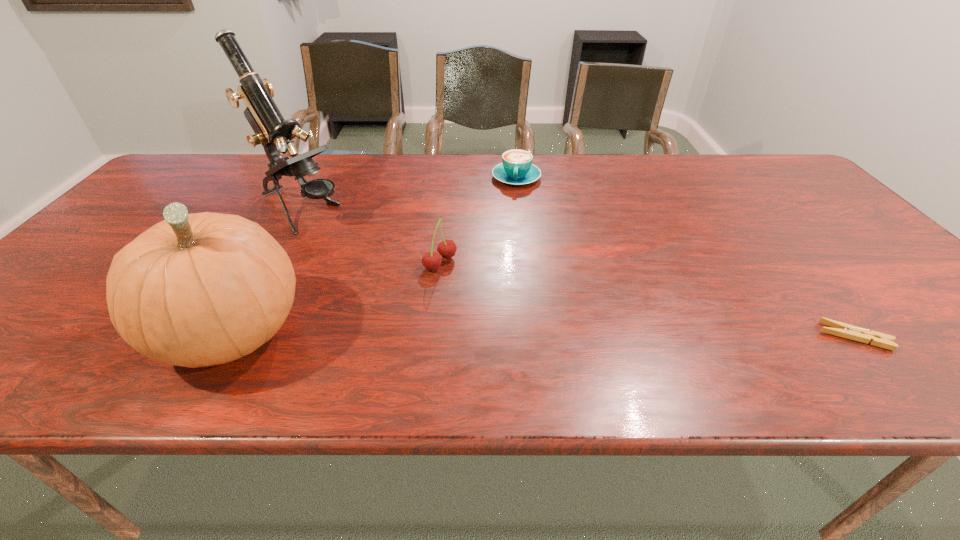
Find the location of `pumpkin that is positioned at the near edge`. pumpkin that is positioned at the near edge is located at coordinates (194, 290).

This screenshot has width=960, height=540. I want to click on clothespin positioned at the near edge, so click(840, 329).

This screenshot has width=960, height=540. In order to click on blank space at the far edge of the desktop in this screenshot , I will do `click(542, 166)`.

Image resolution: width=960 pixels, height=540 pixels. In the image, there is a desktop. In order to click on free space at the near edge in this screenshot , I will do `click(361, 343)`.

You are a GUI agent. You are given a task and a screenshot of the screen. Output one action in this format:
    pyautogui.click(x=<x>, y=<y>)
    Task: Click on the vacant space at the right edge of the desktop
    This screenshot has height=540, width=960.
    Given the screenshot: What is the action you would take?
    pyautogui.click(x=867, y=260)

The image size is (960, 540). Find the location of `vacant space at the far left corner of the desktop`. vacant space at the far left corner of the desktop is located at coordinates (198, 160).

This screenshot has height=540, width=960. Identify the location of vacant region at the far right corner of the desktop. (747, 166).

Find the location of a particular element. unoccupied position between the second shortest object and the third object from right to left is located at coordinates (478, 220).

Locate an element on the screen. This screenshot has height=540, width=960. free space between the second shortest object and the microscope is located at coordinates (409, 194).

Where is `free area in between the pumpkin and the shortest object`? This screenshot has height=540, width=960. free area in between the pumpkin and the shortest object is located at coordinates (543, 335).